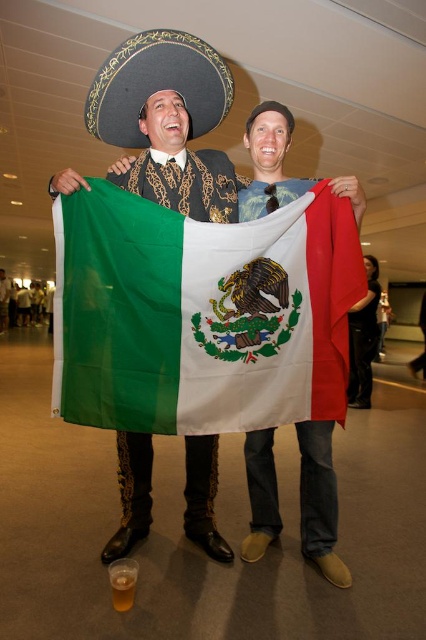
You are an interior designer planning to hang two decorations on a wall. You have the polyester mexican flag at center and the black felt sombrero at upper center. According to the image, which decoration should be placed higher on the wall?

The black felt sombrero at upper center should be placed higher on the wall because in the image, the polyester mexican flag at center is positioned below it.

You are standing in the room where the two people are holding the polyester mexican flag at center. If you want to take a photo of the flag from directly in front of it, where should you position yourself relative to the flag?

The polyester mexican flag at center is located at point (201, 314), so to take a photo from directly in front, you should position yourself facing the flag at that coordinate point.

You are a photographer taking a picture of the scene. The polyester mexican flag at center is located at point (201, 314). If you want to ensure the flag is centered in your photo, where should you aim your camera?

You should aim your camera at point (201, 314) to ensure the polyester mexican flag at center is centered in your photo.